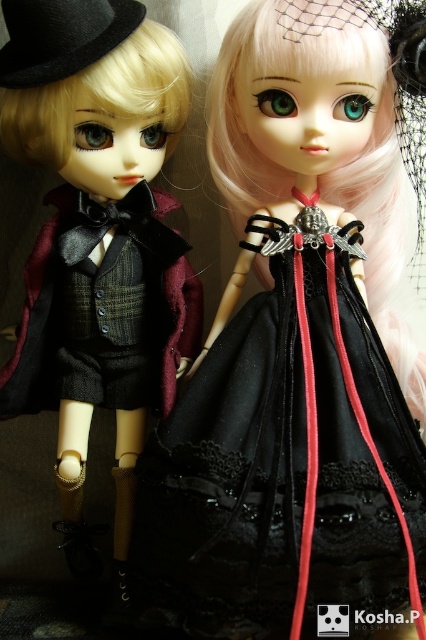
Question: Which point is closer to the camera taking this photo?

Choices:
 (A) (181, 320)
 (B) (66, 22)
 (C) (170, 356)

Answer: (B)

Question: Can you confirm if matte black dress at center is positioned above matte black coat at left?

Choices:
 (A) no
 (B) yes

Answer: (A)

Question: Considering the real-world distances, which object is farthest from the matte black coat at left?

Choices:
 (A) plaid wool vest at center
 (B) black felt hat at upper left
 (C) matte black dress at center

Answer: (B)

Question: Which object is the closest to the plaid wool vest at center?

Choices:
 (A) matte black coat at left
 (B) black felt hat at upper left
 (C) matte black dress at center

Answer: (A)

Question: Does matte black dress at center have a greater width compared to matte black coat at left?

Choices:
 (A) no
 (B) yes

Answer: (B)

Question: Is matte black dress at center positioned before black felt hat at upper left?

Choices:
 (A) no
 (B) yes

Answer: (B)